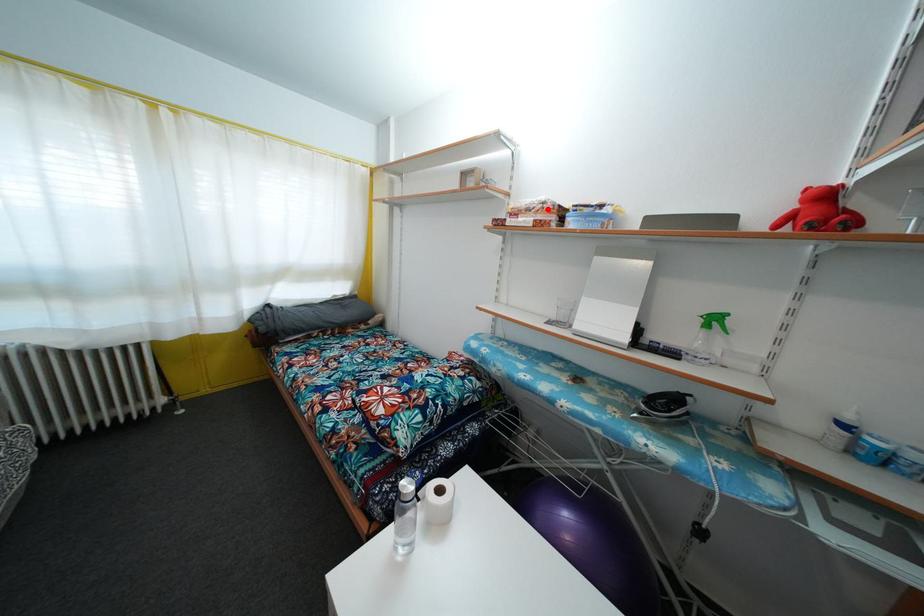
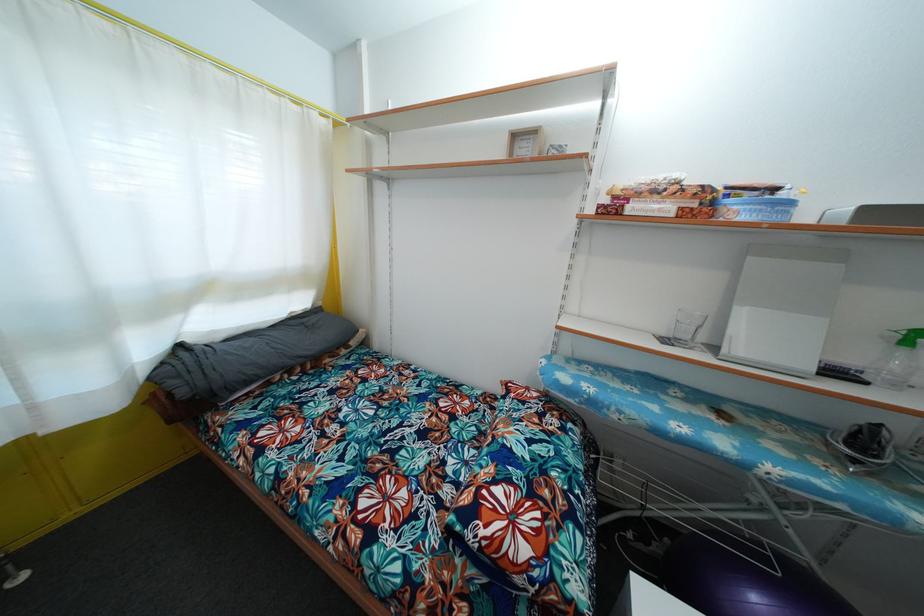
Locate, in the second image, the point that corresponds to the highlighted location in the first image.

(683, 188)